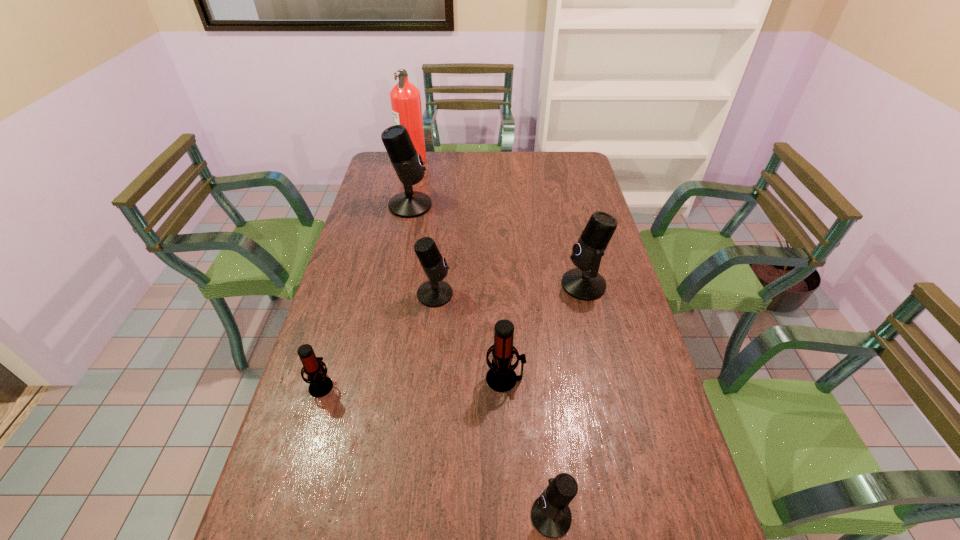
The width and height of the screenshot is (960, 540). What are the coordinates of `free point at the far left corner` in the screenshot? It's located at (390, 165).

The image size is (960, 540). Find the location of `free spot at the far right corner of the desktop`. free spot at the far right corner of the desktop is located at coordinates (566, 165).

The image size is (960, 540). I want to click on vacant space that's between the bigger red microphone and the left red microphone, so click(413, 382).

Identify the location of free space that is in between the nearest black microphone and the smaller red microphone. (436, 450).

Identify the location of free spot between the nearest object and the rightmost object. (567, 400).

Image resolution: width=960 pixels, height=540 pixels. I want to click on free space between the farthest object and the right red microphone, so click(459, 269).

Where is `unoccupied area between the rightmost microphone and the right red microphone`? The height and width of the screenshot is (540, 960). unoccupied area between the rightmost microphone and the right red microphone is located at coordinates (544, 332).

Locate an element on the screen. vacant area that lies between the farthest object and the bigger red microphone is located at coordinates (459, 269).

Where is `vacant area that lies between the fifth shortest object and the right red microphone`? vacant area that lies between the fifth shortest object and the right red microphone is located at coordinates (544, 332).

You are a GUI agent. You are given a task and a screenshot of the screen. Output one action in this format:
    pyautogui.click(x=<x>, y=<y>)
    Task: Click on the free spot between the tallest microphone and the leftmost object
    
    Given the screenshot: What is the action you would take?
    pyautogui.click(x=366, y=295)